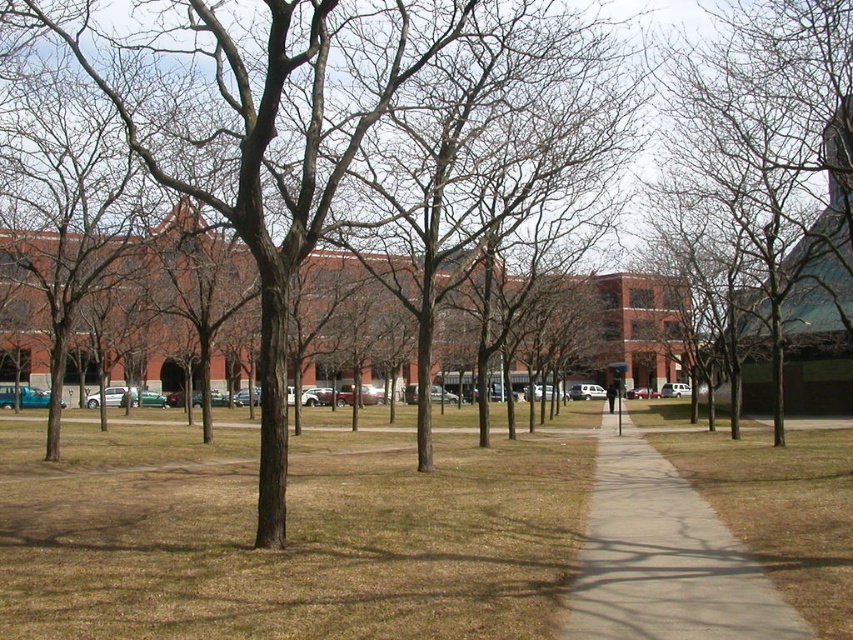
You are standing at the point marked as point (288, 538) in the image. What is the ground condition there?

The ground at point (288, 538) is covered with brown dry grass.

You are standing at the entrance of the large brick building and want to walk to the brown dry grass at center. Which direction should you go?

You should go south to reach the brown dry grass at center because it is located at point (288, 538), which is south of the building.